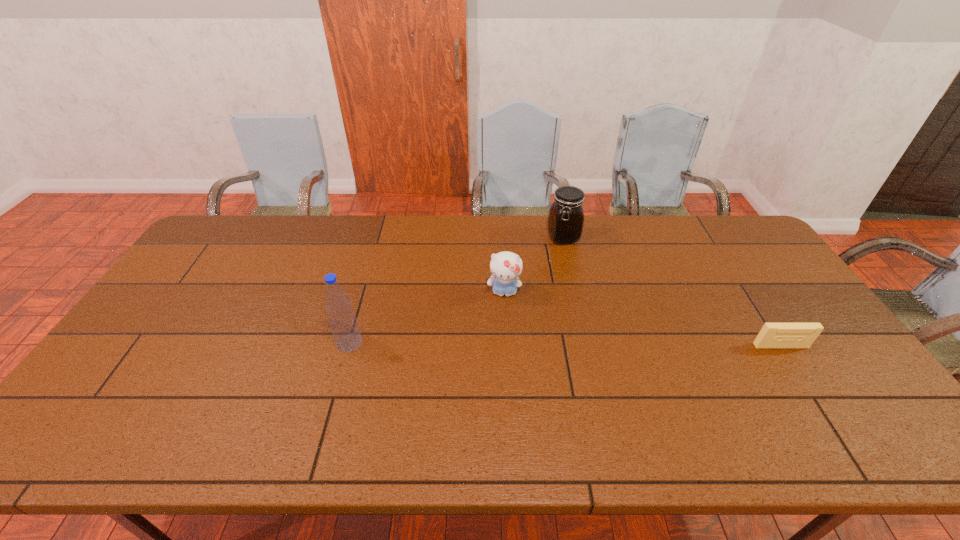
Where is `vacant space on the desktop that is between the leftmost object and the rightmost object and is positioned on the lid of the third object from left to right`? The height and width of the screenshot is (540, 960). vacant space on the desktop that is between the leftmost object and the rightmost object and is positioned on the lid of the third object from left to right is located at coordinates (620, 345).

Where is `vacant spot on the desktop that is between the water bottle and the rightmost object and is positioned on the front-facing side of the third object from right to left`? This screenshot has height=540, width=960. vacant spot on the desktop that is between the water bottle and the rightmost object and is positioned on the front-facing side of the third object from right to left is located at coordinates (502, 344).